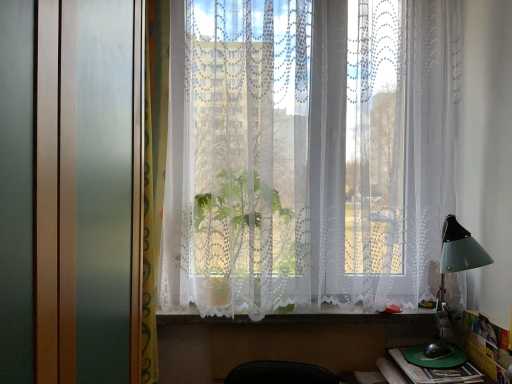
Question: Can you confirm if white lace curtains at center is smaller than white lace curtain at lower center?

Choices:
 (A) yes
 (B) no

Answer: (B)

Question: From the image's perspective, is white lace curtains at center located beneath white lace curtain at lower center?

Choices:
 (A) yes
 (B) no

Answer: (B)

Question: Is white lace curtains at center next to white lace curtain at lower center?

Choices:
 (A) no
 (B) yes

Answer: (A)

Question: Can you confirm if white lace curtains at center is positioned to the right of white lace curtain at lower center?

Choices:
 (A) no
 (B) yes

Answer: (B)

Question: From a real-world perspective, is white lace curtains at center beneath white lace curtain at lower center?

Choices:
 (A) no
 (B) yes

Answer: (A)

Question: Is white lace curtains at center closer to the viewer compared to white lace curtain at lower center?

Choices:
 (A) yes
 (B) no

Answer: (A)

Question: From a real-world perspective, is green plastic book at lower right physically above green plastic plate at lower right?

Choices:
 (A) yes
 (B) no

Answer: (B)

Question: From a real-world perspective, is green plastic book at lower right positioned under green plastic plate at lower right based on gravity?

Choices:
 (A) yes
 (B) no

Answer: (A)

Question: Is green plastic book at lower right at the right side of green plastic plate at lower right?

Choices:
 (A) yes
 (B) no

Answer: (B)

Question: Is green plastic book at lower right in front of green plastic plate at lower right?

Choices:
 (A) no
 (B) yes

Answer: (B)

Question: Is green plastic book at lower right next to green plastic plate at lower right and touching it?

Choices:
 (A) no
 (B) yes

Answer: (B)

Question: Is green plastic book at lower right surrounding green plastic plate at lower right?

Choices:
 (A) no
 (B) yes

Answer: (A)

Question: Can you confirm if white lace curtains at center is thinner than green patterned curtain at left?

Choices:
 (A) no
 (B) yes

Answer: (A)